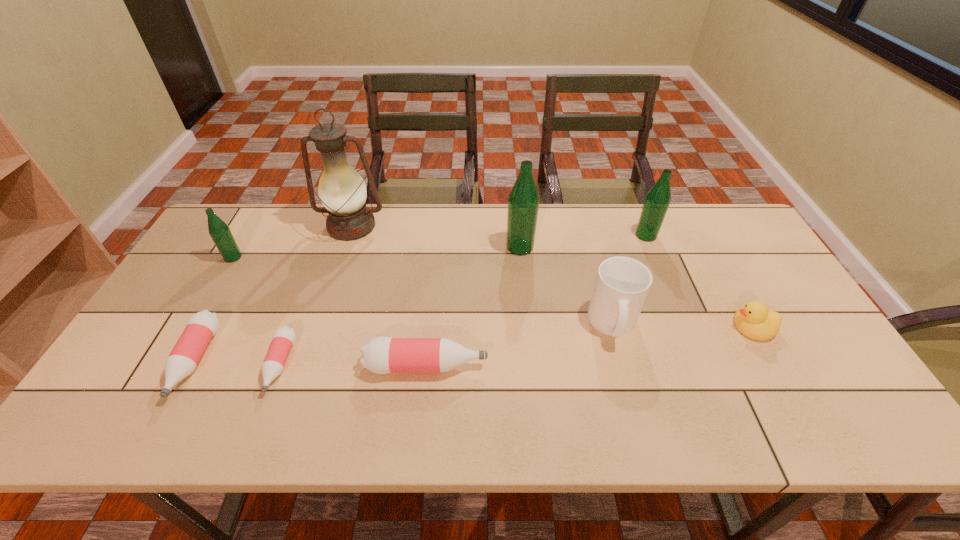
The image size is (960, 540). What are the coordinates of `the fourth bottle from left to right` in the screenshot? It's located at (381, 355).

You are a GUI agent. You are given a task and a screenshot of the screen. Output one action in this format:
    pyautogui.click(x=<x>, y=<y>)
    Task: Click on the yellow duckling
    This screenshot has height=540, width=960.
    Given the screenshot: What is the action you would take?
    pyautogui.click(x=754, y=320)

I want to click on the rightmost object, so click(x=754, y=320).

Locate an element on the screen. This screenshot has height=540, width=960. the second smallest pink bottle is located at coordinates (202, 326).

In order to click on the leftmost pink bottle in this screenshot , I will do `click(202, 326)`.

At what (x,y) coordinates should I click in order to perform the action: click on the shortest object. Please return your answer as a coordinate pair (x, y). Looking at the image, I should click on (283, 338).

Where is `the fourth bottle from right to left`? the fourth bottle from right to left is located at coordinates (283, 338).

Image resolution: width=960 pixels, height=540 pixels. I want to click on free space located 0.120m on the right of the oil lamp, so click(421, 226).

Identify the location of vacant space located on the right of the tallest bottle. (655, 247).

Find the location of a particular element. Image resolution: width=960 pixels, height=540 pixels. free space located 0.250m on the left of the second smallest green bottle is located at coordinates (558, 235).